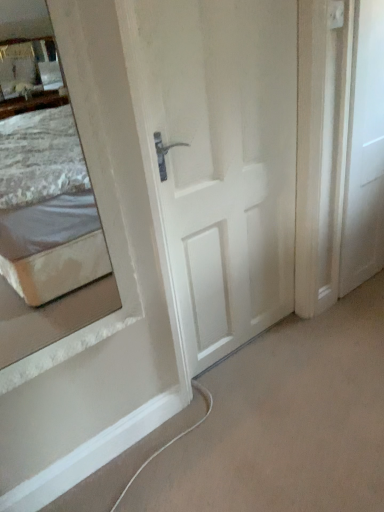
Question: Looking at the image, does white matte door at right, which is counted as the 1th door, starting from the right, seem bigger or smaller compared to white matte door at center, the 1th door positioned from the left?

Choices:
 (A) big
 (B) small

Answer: (B)

Question: Based on their positions, is white matte door at right, which is counted as the 1th door, starting from the right, located to the left or right of white matte door at center, the 1th door positioned from the left?

Choices:
 (A) right
 (B) left

Answer: (A)

Question: Does point (375, 151) appear closer or farther from the camera than point (206, 131)?

Choices:
 (A) farther
 (B) closer

Answer: (A)

Question: From their relative heights in the image, would you say white matte door at center, the second door when ordered from right to left, is taller or shorter than white matte door at right, which is counted as the 1th door, starting from the right?

Choices:
 (A) short
 (B) tall

Answer: (B)

Question: Looking at the image, does white matte door at center, the 1th door positioned from the left, seem bigger or smaller compared to white matte door at right, the second door from the left?

Choices:
 (A) big
 (B) small

Answer: (A)

Question: Is white matte door at center, the 1th door positioned from the left, in front of or behind white matte door at right, which is counted as the 1th door, starting from the right, in the image?

Choices:
 (A) behind
 (B) front

Answer: (B)

Question: From the image's perspective, relative to white matte door at right, the second door from the left, is white matte door at center, the 1th door positioned from the left, above or below?

Choices:
 (A) below
 (B) above

Answer: (A)